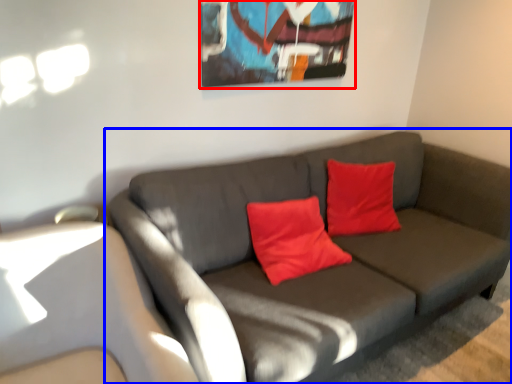
Question: Which object appears farthest to the camera in this image, picture frame (highlighted by a red box) or studio couch (highlighted by a blue box)?

Choices:
 (A) picture frame
 (B) studio couch

Answer: (A)